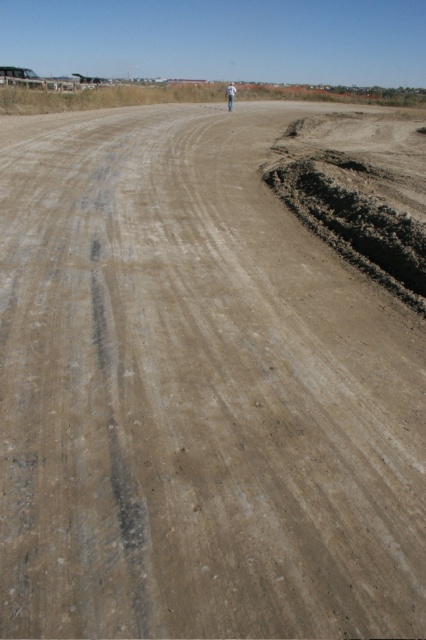
You are a delivery driver who needs to drive a truck that is 2 meters wide across the unpaved road shown in the image. The road has a dark brown clay at right and a light brown skin at center. Which part of the road should you avoid to ensure your truck can pass safely?

You should avoid the dark brown clay at right because its width is larger than the light brown skin at center, meaning the light brown skin at center area is narrower and might not accommodate the truck safely. Wait, actually, the description says the clay at right is wider. So the truck should avoid the wider area? Hmm, maybe I need to think again. If the clay is wider, then the road might be narrower elsewhere? Wait, the objects are the clay and the skin. The road itself is unpaved. The question is about,

From the picture: You are a delivery driver trying to avoid the dark brown clay at right and the light brown skin at center while driving on the unpaved road. Which object should you steer away from first?

The dark brown clay at right is in front of the light brown skin at center, so you should steer away from the dark brown clay at right first.